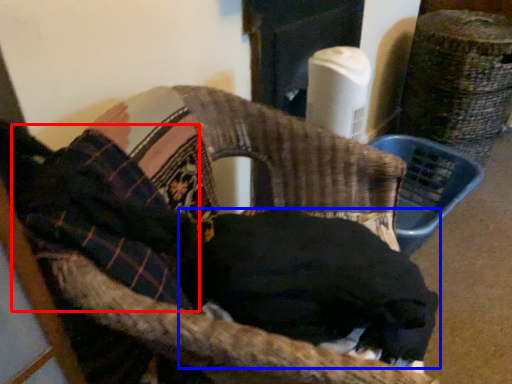
Question: Which object is closer to the camera taking this photo, clothing (highlighted by a red box) or dog (highlighted by a blue box)?

Choices:
 (A) clothing
 (B) dog

Answer: (A)